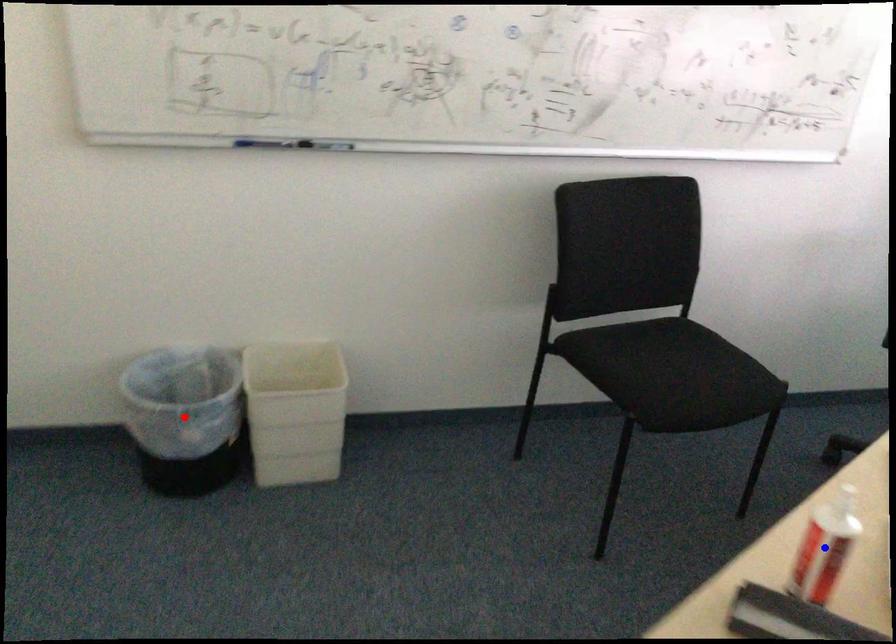
Question: Which of the two points in the image is closer to the camera?

Choices:
 (A) Blue point is closer.
 (B) Red point is closer.

Answer: (A)